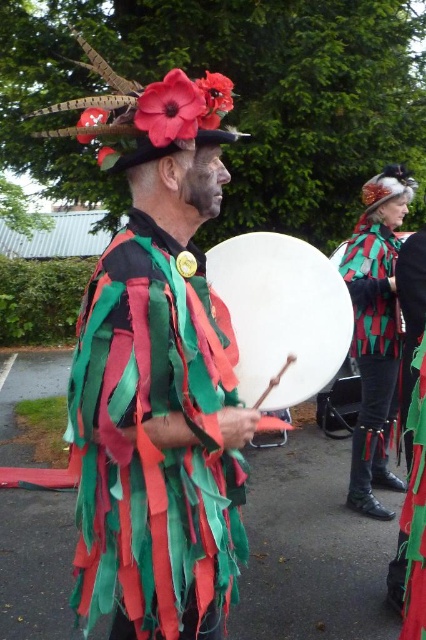
Does textured fabric cape at center appear on the right side of green textured fabric at center?

No, textured fabric cape at center is not to the right of green textured fabric at center.

Consider the image. Does textured fabric cape at center have a lesser width compared to green textured fabric at center?

No, textured fabric cape at center is not thinner than green textured fabric at center.

Find the location of a particular element. The width and height of the screenshot is (426, 640). textured fabric cape at center is located at coordinates (155, 444).

Is textured fabric cape at center wider than white leather drum at center?

Indeed, textured fabric cape at center has a greater width compared to white leather drum at center.

Which of these two, textured fabric cape at center or white leather drum at center, stands shorter?

white leather drum at center

Is point (137, 285) positioned behind point (270, 252)?

No, (137, 285) is in front of (270, 252).

Where is `textured fabric cape at center`? This screenshot has width=426, height=640. textured fabric cape at center is located at coordinates (155, 444).

Does white leather drum at center have a smaller size compared to green textured fabric at center?

Correct, white leather drum at center occupies less space than green textured fabric at center.

Is point (258, 298) more distant than point (388, 384)?

No, it is not.

The width and height of the screenshot is (426, 640). Describe the element at coordinates (282, 314) in the screenshot. I see `white leather drum at center` at that location.

This screenshot has height=640, width=426. I want to click on white leather drum at center, so click(282, 314).